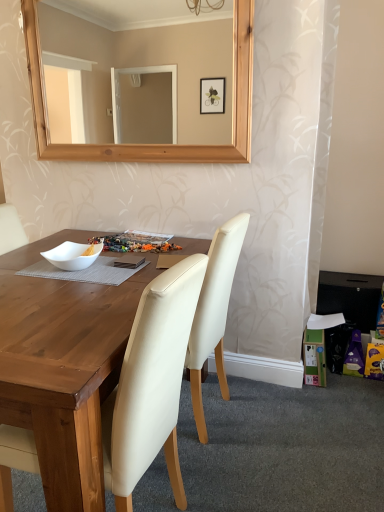
Question: From a real-world perspective, is cream leather chair at center, which is counted as the first chair, starting from the front, above or below cream leather chair at center, the first chair viewed from the back?

Choices:
 (A) above
 (B) below

Answer: (A)

Question: Does point (135, 346) appear closer or farther from the camera than point (206, 342)?

Choices:
 (A) closer
 (B) farther

Answer: (A)

Question: Based on their relative distances, which object is farther from the white matte bowl at center?

Choices:
 (A) cream leather chair at center, the second chair viewed from the front
 (B) cream leather chair at center, arranged as the 2th chair when viewed from the back

Answer: (B)

Question: Estimate the real-world distances between objects in this image. Which object is farther from the white matte bowl at center?

Choices:
 (A) cream leather chair at center, the second chair viewed from the front
 (B) cream leather chair at center, arranged as the 2th chair when viewed from the back

Answer: (B)